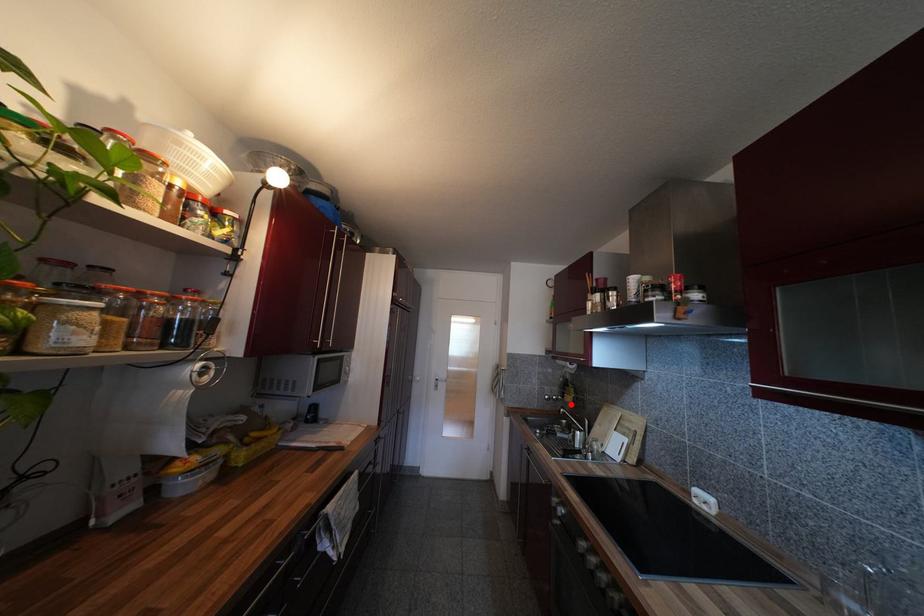
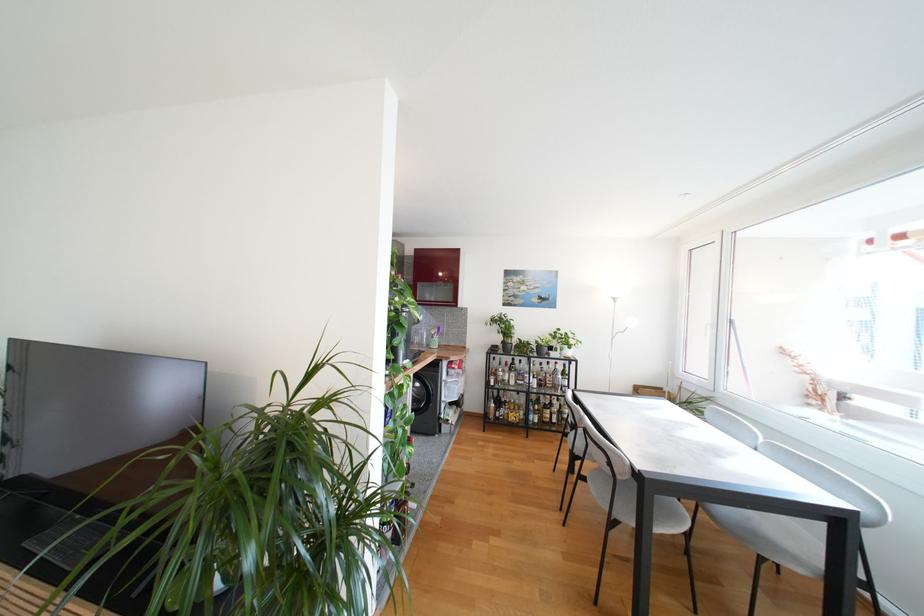
Question: I am providing you with two images of the same scene from different viewpoints. A red point is marked on the first image. At the location where the point appears in image 1, is it still visible in image 2?

Choices:
 (A) Yes
 (B) No

Answer: (B)